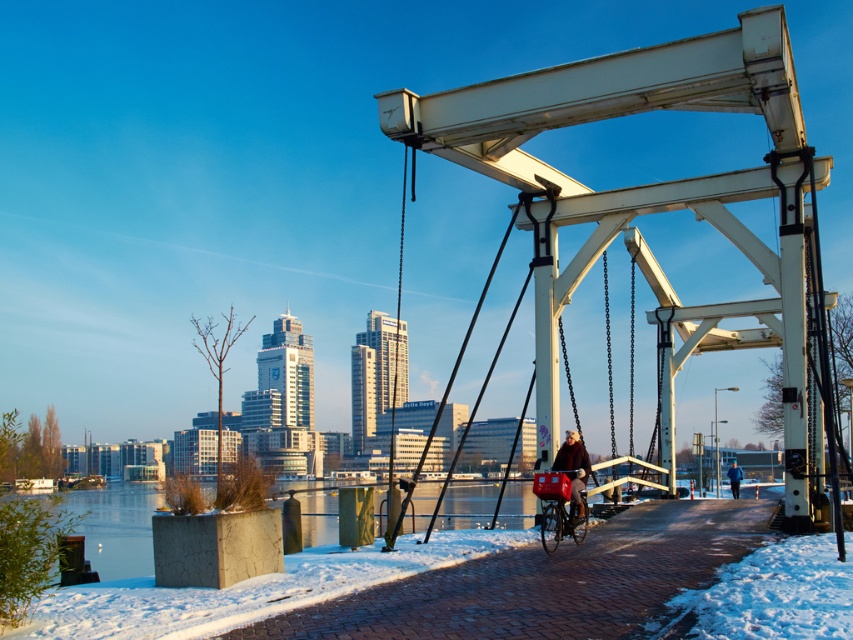
Does dark brown leather jacket at center have a lesser width compared to dark blue jacket at center?

Indeed, dark brown leather jacket at center has a lesser width compared to dark blue jacket at center.

From the picture: Does dark brown leather jacket at center have a greater height compared to dark blue jacket at center?

No.

Find the location of `dark brown leather jacket at center`. dark brown leather jacket at center is located at coordinates (573, 468).

You are a GUI agent. You are given a task and a screenshot of the screen. Output one action in this format:
    pyautogui.click(x=<x>, y=<y>)
    Task: Click on the dark brown leather jacket at center
    The height and width of the screenshot is (640, 853).
    Given the screenshot: What is the action you would take?
    pyautogui.click(x=573, y=468)

Is matte red bicycle at lower center positioned at the back of dark blue jacket at center?

That is False.

Between point (541, 499) and point (738, 472), which one is positioned in front?

Point (541, 499)

At what (x,y) coordinates should I click in order to perform the action: click on matte red bicycle at lower center. Please return your answer as a coordinate pair (x, y). This screenshot has width=853, height=640. Looking at the image, I should click on (558, 509).

Is matte red bicycle at lower center thinner than dark brown leather jacket at center?

Yes.

Describe the element at coordinates (558, 509) in the screenshot. I see `matte red bicycle at lower center` at that location.

Does point (547, 474) come in front of point (566, 467)?

Yes, point (547, 474) is closer to viewer.

This screenshot has height=640, width=853. Find the location of `matte red bicycle at lower center`. matte red bicycle at lower center is located at coordinates tap(558, 509).